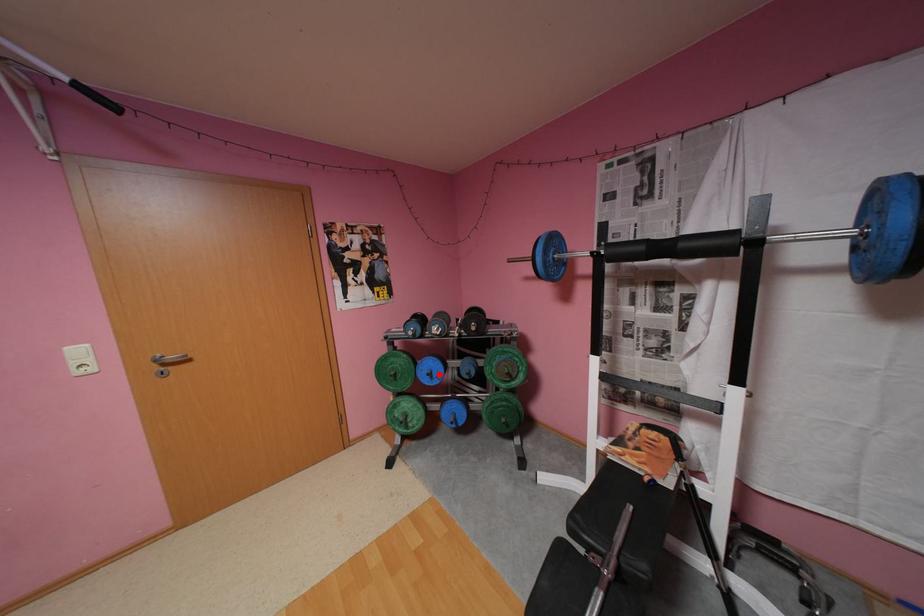
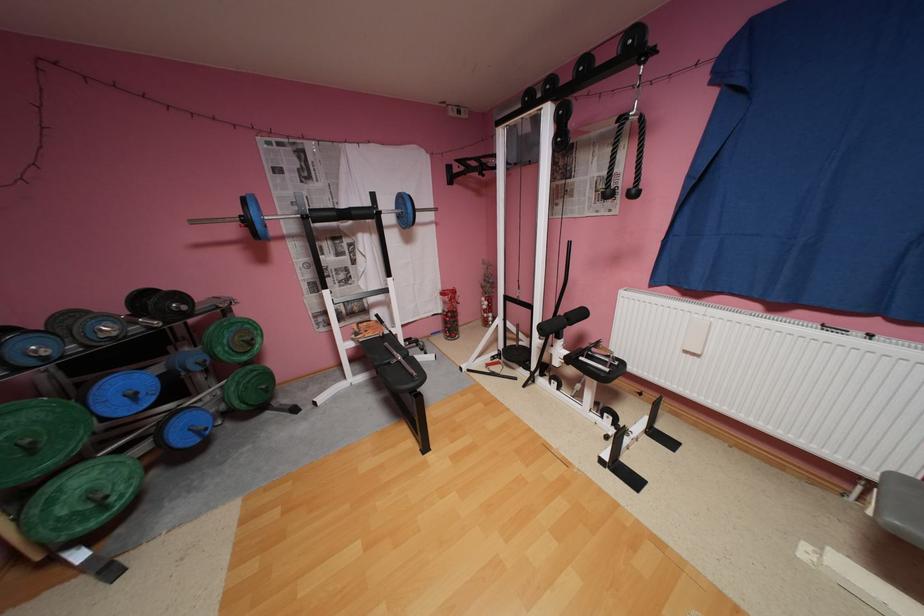
In the second image, find the point that corresponds to the highlighted location in the first image.

(142, 395)